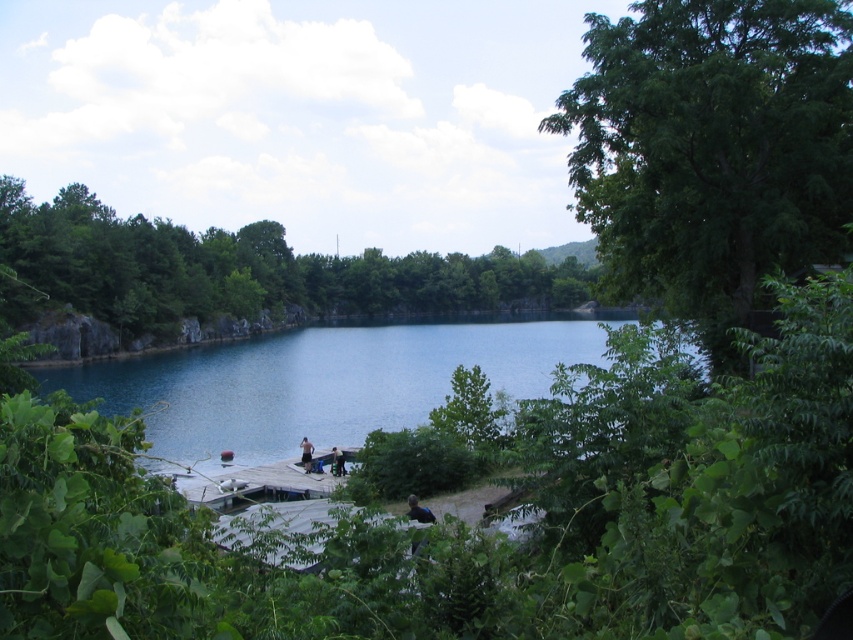
Between wooden dock at center and dark blue shirt at center, which one appears on the right side from the viewer's perspective?

wooden dock at center is more to the right.

Who is more forward, (299, 488) or (310, 467)?

Positioned in front is point (299, 488).

Find the location of a particular element. The width and height of the screenshot is (853, 640). wooden dock at center is located at coordinates (256, 483).

Can you confirm if blue water at center is smaller than wooden dock at center?

No.

Find the location of `blue water at center`. blue water at center is located at coordinates (318, 381).

Is point (234, 378) in front of point (247, 504)?

No, (234, 378) is behind (247, 504).

This screenshot has width=853, height=640. Find the location of `blue water at center`. blue water at center is located at coordinates (318, 381).

Which of these two, blue water at center or dark blue shirt at center, stands shorter?

With less height is dark blue shirt at center.

Does point (262, 339) come farther from viewer compared to point (306, 456)?

Yes, it is behind point (306, 456).

Where is `blue water at center`? blue water at center is located at coordinates (318, 381).